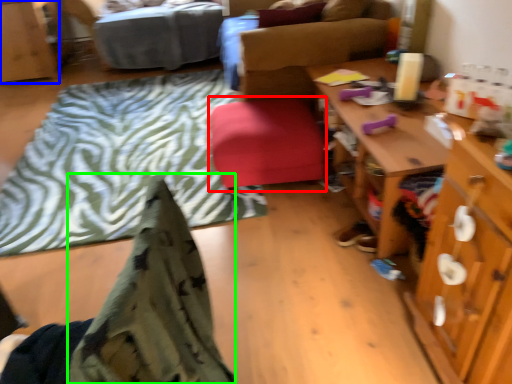
Question: Estimate the real-world distances between objects in this image. Which object is farther from stool (highlighted by a red box), cabinetry (highlighted by a blue box) or blanket (highlighted by a green box)?

Choices:
 (A) cabinetry
 (B) blanket

Answer: (A)